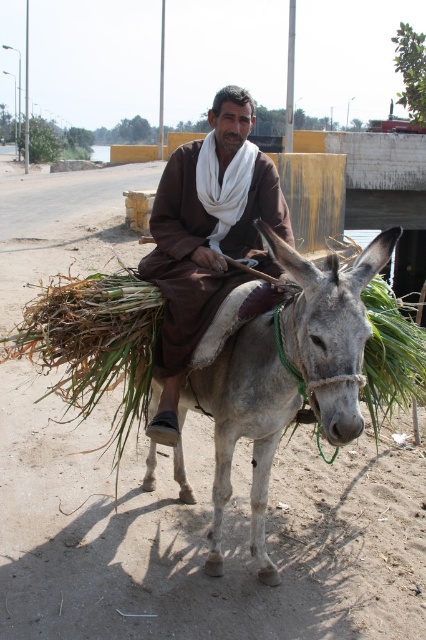
Question: Is gray matte/sand-colored mule at center to the right of green leafy plant at upper right from the viewer's perspective?

Choices:
 (A) yes
 (B) no

Answer: (B)

Question: Which object is farther from the camera taking this photo?

Choices:
 (A) green leafy plant at upper right
 (B) green leafy plant at center
 (C) brown cotton robe at center

Answer: (B)

Question: Based on their relative distances, which object is nearer to the brown cotton robe at center?

Choices:
 (A) green leafy plant at center
 (B) green leafy plant at upper right

Answer: (B)

Question: Is brown cotton robe at center thinner than green leafy plant at center?

Choices:
 (A) no
 (B) yes

Answer: (B)

Question: In this image, where is gray matte/sand-colored mule at center located relative to green leafy plant at upper right?

Choices:
 (A) below
 (B) above

Answer: (A)

Question: Considering the real-world distances, which object is closest to the green leafy plant at upper right?

Choices:
 (A) brown cotton robe at center
 (B) gray matte/sand-colored mule at center

Answer: (B)